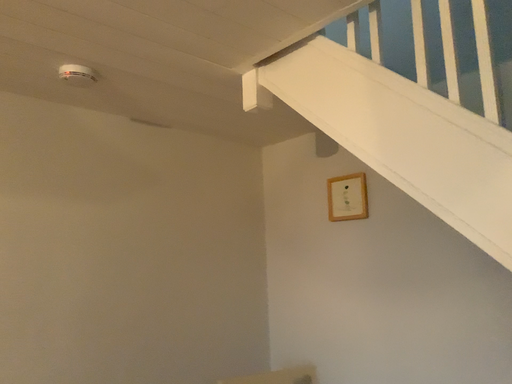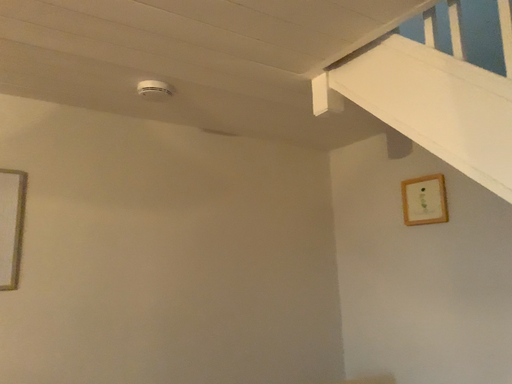
Question: Which way did the camera rotate in the video?

Choices:
 (A) rotated left
 (B) rotated right

Answer: (A)